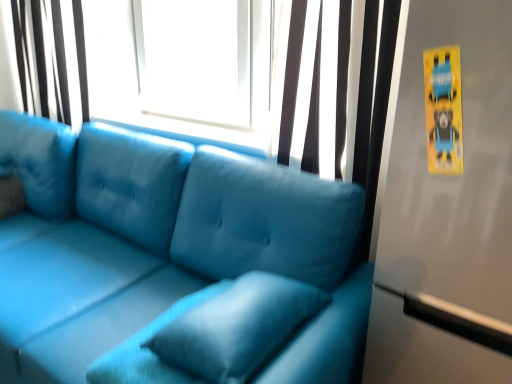
Question: Considering the relative positions of matte black curtain at upper center, the second curtain viewed from the back, and velvet blue pillow at center in the image provided, is matte black curtain at upper center, the second curtain viewed from the back, to the left or to the right of velvet blue pillow at center?

Choices:
 (A) right
 (B) left

Answer: (A)

Question: Considering their positions, is matte black curtain at upper center, acting as the 2th curtain starting from the left, located in front of or behind velvet blue pillow at center?

Choices:
 (A) front
 (B) behind

Answer: (B)

Question: Estimate the real-world distances between objects in this image. Which object is farther from the transparent glass window at upper center?

Choices:
 (A) matte black curtain at upper center, acting as the 2th curtain starting from the left
 (B) velvet blue pillow at center
 (C) matte blue couch at center
 (D) matte white curtain at upper left, the 2th curtain in the right-to-left sequence

Answer: (B)

Question: Which object is the closest to the transparent glass window at upper center?

Choices:
 (A) velvet blue pillow at center
 (B) matte blue couch at center
 (C) matte black curtain at upper center, positioned as the 1th curtain in right-to-left order
 (D) matte white curtain at upper left, the 2th curtain in the right-to-left sequence

Answer: (D)